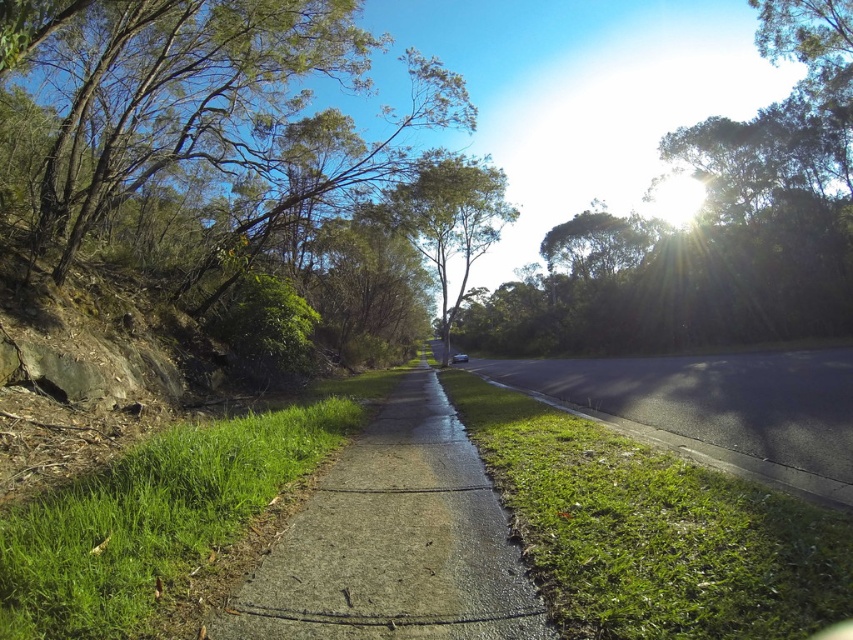
Question: Which object appears closest to the camera in this image?

Choices:
 (A) green leafy tree at center
 (B) green leafy tree at left

Answer: (B)

Question: Which point is farther from the camera taking this photo?

Choices:
 (A) (402, 205)
 (B) (790, 380)

Answer: (A)

Question: Is concrete at center further to camera compared to green grass at lower left?

Choices:
 (A) yes
 (B) no

Answer: (A)

Question: From the image, what is the correct spatial relationship of black asphalt pavement at center in relation to green leafy tree at center?

Choices:
 (A) below
 (B) above

Answer: (A)

Question: Where is green leafy tree at upper center located in relation to green grass at lower left in the image?

Choices:
 (A) right
 (B) left

Answer: (A)

Question: Which of the following is the farthest from the observer?

Choices:
 (A) (225, 198)
 (B) (321, 573)
 (C) (144, 525)
 (D) (641, 401)

Answer: (A)